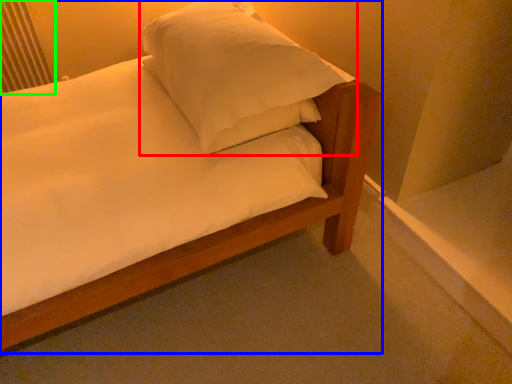
Question: Based on their relative distances, which object is farther from pillow (highlighted by a red box)? Choose from bed (highlighted by a blue box) and radiator (highlighted by a green box).

Choices:
 (A) bed
 (B) radiator

Answer: (B)